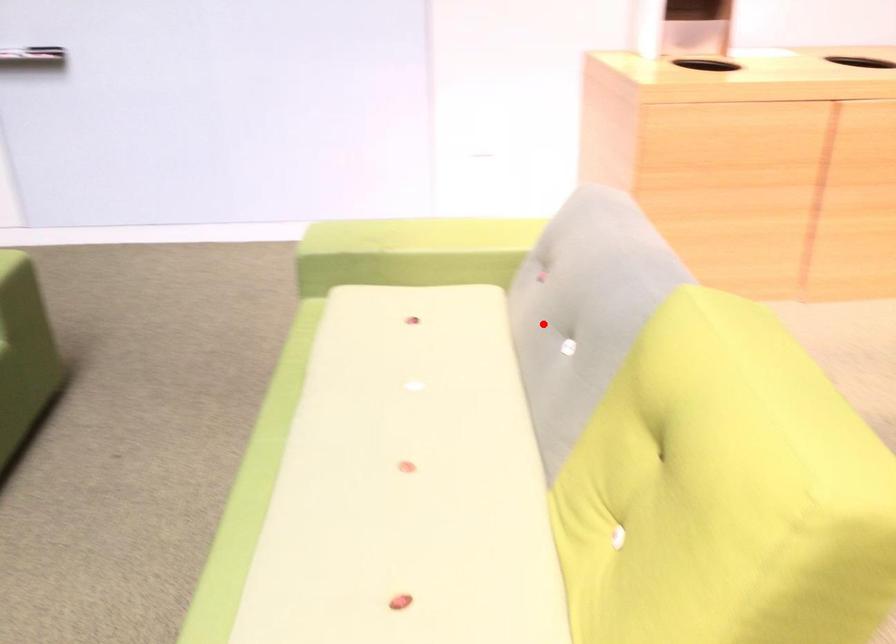
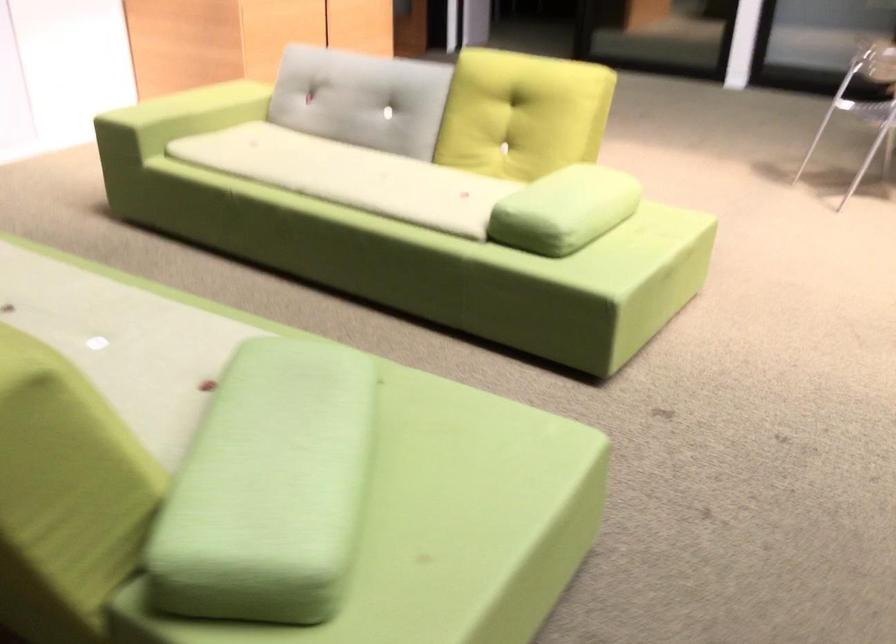
The point at the highlighted location is marked in the first image. Where is the corresponding point in the second image?

(362, 99)